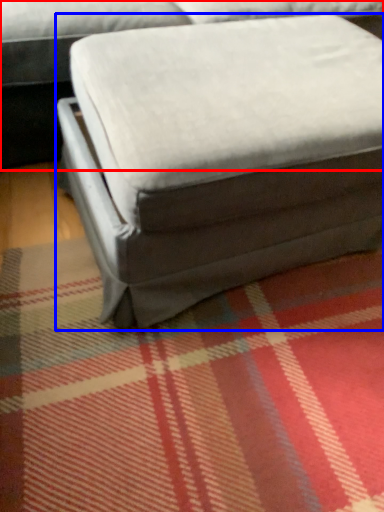
Question: Which object appears farthest to the camera in this image, studio couch (highlighted by a red box) or bean bag chair (highlighted by a blue box)?

Choices:
 (A) studio couch
 (B) bean bag chair

Answer: (A)